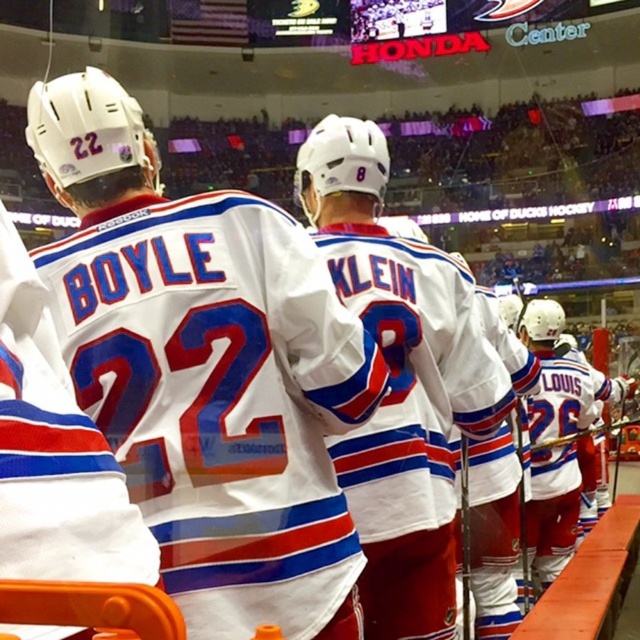
You are an equipment manager at the Honda Center and need to store two white jerseys at center. The storage space has a width limit of 30 cm. The white matte jersey at center is wider than the white jersey at center. If the narrower jersey fits perfectly at 28 cm, will the wider one also fit?

The white matte jersey at center is wider than the white jersey at center. Since the narrower jersey is 28 cm and the storage limit is 30 cm, the wider jersey exceeds the 30 cm limit and won

You are a photographer at the Honda Center and need to capture a clear photo of both the white matte jersey at center and the white jersey at center. Since they are overlapping, which jersey should you adjust to ensure both are visible in the photo?

The white matte jersey at center is positioned over white jersey at center, so you should adjust the white matte jersey at center to move it slightly to reveal the white jersey at center underneath.

You are a photographer at the Honda Center and need to capture a clear shot of both the white matte jersey at center and the white jersey at center. Since the camera can only focus on one height at a time, which jersey should you adjust the focus for to ensure both are in focus?

The white matte jersey at center is shorter than the white jersey at center. To ensure both are in focus, adjust the camera focus to the midpoint between their heights.